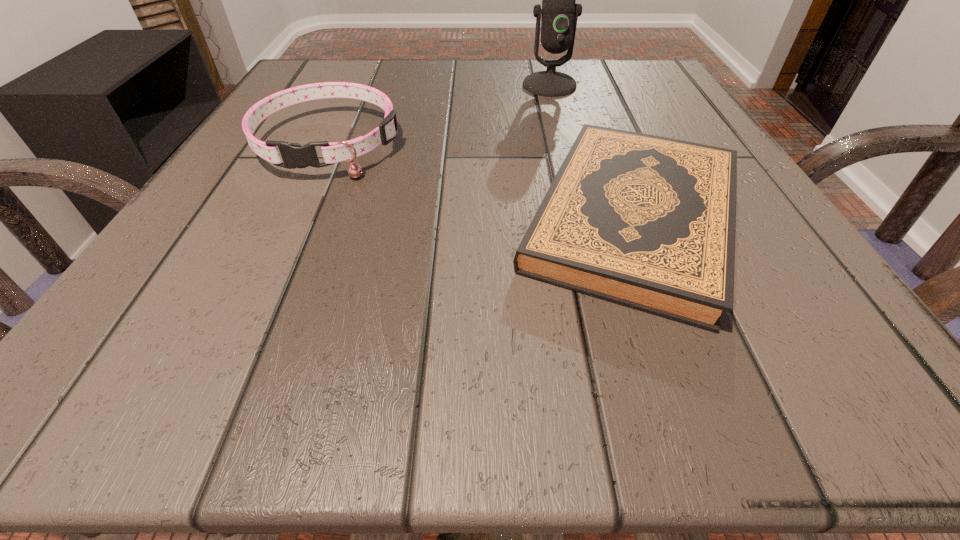
Find the location of a particular element. vacant area in the image that satisfies the following two spatial constraints: 1. on the front side of the hardback book; 2. on the left side of the farthest object is located at coordinates click(584, 218).

At what (x,y) coordinates should I click in order to perform the action: click on vacant point that satisfies the following two spatial constraints: 1. on the front side of the tallest object; 2. on the right side of the shortest object. Please return your answer as a coordinate pair (x, y). Image resolution: width=960 pixels, height=540 pixels. Looking at the image, I should click on (584, 218).